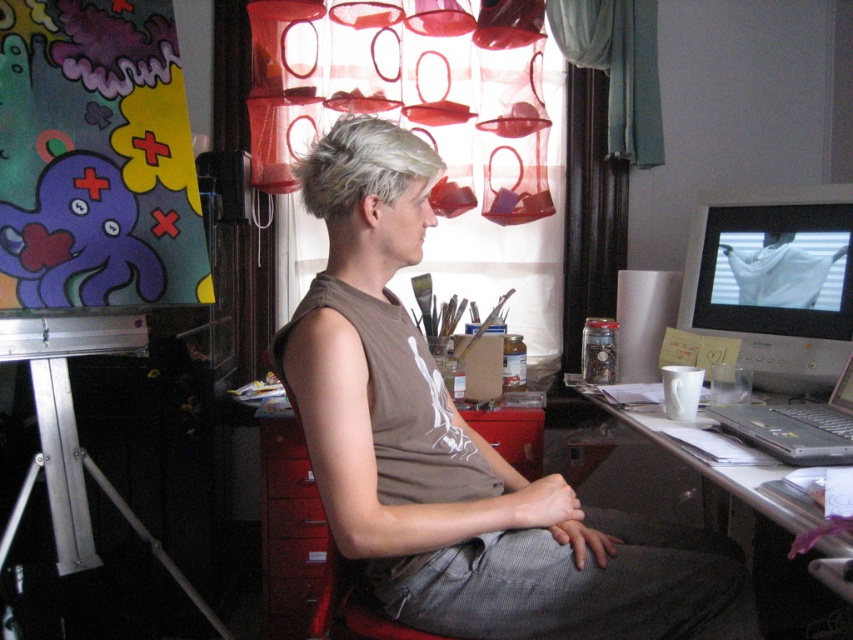
From the picture: You are an interior designer assessing the workspace. You need to determine if the matte black monitor at upper right can be moved to a shelf that currently holds the gray matte hair at upper center without exceeding the shelf space. Can it fit based on their sizes?

The matte black monitor at upper right is bigger than gray matte hair at upper center. Therefore, moving the matte black monitor at upper right to the shelf that holds the gray matte hair at upper center may not fit due to its larger size.

You are an interior designer assessing the workspace layout. You need to ensure that the matte black monitor at upper right and the gray matte hair at upper center are positioned for optimal visibility. Based on their current positions, which object is closer to the desk surface?

The matte black monitor at upper right is below gray matte hair at upper center, so the matte black monitor at upper right is closer to the desk surface.

What are the coordinates of the matte black monitor at upper right?

The coordinates of the matte black monitor at upper right are at point (775, 282).